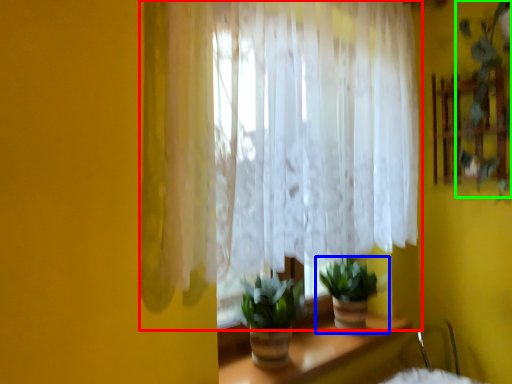
Question: Which object is the closest to the curtain (highlighted by a red box)? Choose among these: houseplant (highlighted by a blue box) or plant (highlighted by a green box).

Choices:
 (A) houseplant
 (B) plant

Answer: (A)